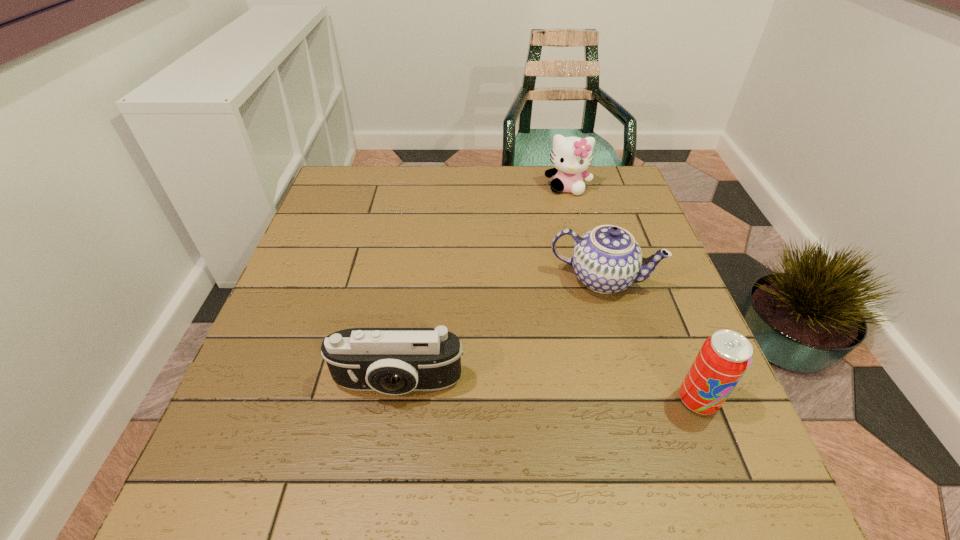
I want to click on vacant space located on the front-facing side of the farthest object, so click(563, 266).

The height and width of the screenshot is (540, 960). In order to click on vacant space positioned on the front-facing side of the farthest object in this screenshot , I will do `click(562, 286)`.

Identify the location of object positioned at the far edge. (571, 156).

Where is `camera situated at the near edge`? camera situated at the near edge is located at coordinates (394, 361).

This screenshot has height=540, width=960. Find the location of `soda can that is at the near edge`. soda can that is at the near edge is located at coordinates (724, 357).

This screenshot has height=540, width=960. Identify the location of soda can at the right edge. (724, 357).

Where is `chinaware present at the right edge`? This screenshot has height=540, width=960. chinaware present at the right edge is located at coordinates (607, 259).

Where is `kitten situated at the right edge`? kitten situated at the right edge is located at coordinates (571, 156).

This screenshot has height=540, width=960. What are the coordinates of `object located in the far right corner section of the desktop` in the screenshot? It's located at (571, 156).

The height and width of the screenshot is (540, 960). In order to click on object that is at the near right corner in this screenshot , I will do `click(724, 357)`.